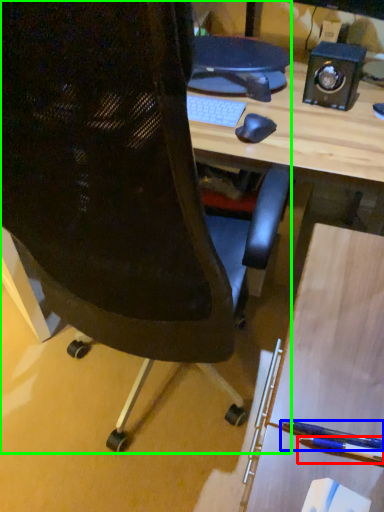
Question: Which is farther away from pencil (highlighted by a red box)? penguin (highlighted by a blue box) or chair (highlighted by a green box)?

Choices:
 (A) penguin
 (B) chair

Answer: (B)